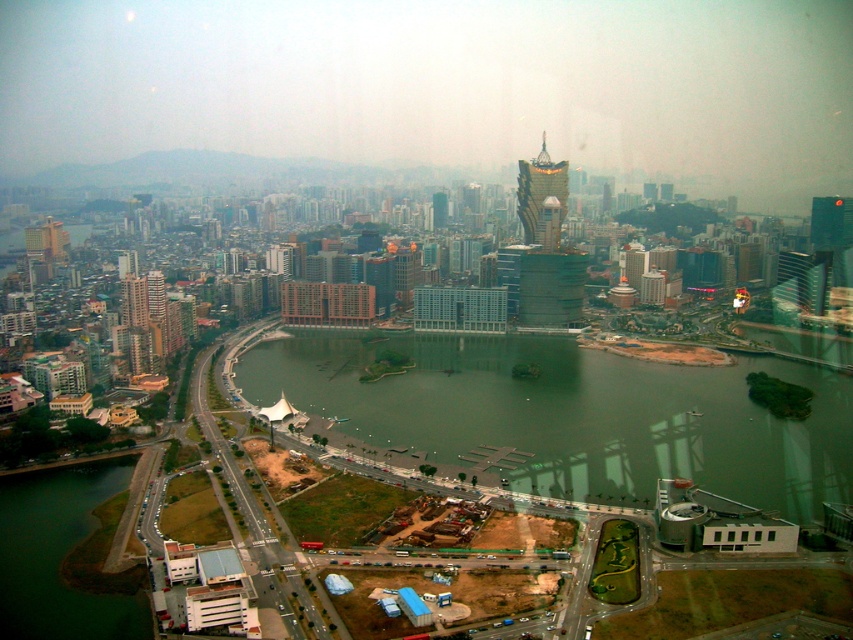
You are standing at the edge of the construction site and want to reach the point marked at coordinates point (68, 628). Given that the construction site is 60 meters wide, can you safely walk across it to reach that point?

The point marked at coordinates point (68, 628) is 68.92 meters away from the viewer. Since the construction site is only 60 meters wide, you would need to walk an extra 8.92 meters beyond the construction site to reach the point, so it might not be safe to walk across the entire distance as the point is outside the construction site area.

You are standing at the edge of the green grassy embankment at lower left and want to walk towards the gold reflective tower at center. Is the tower visible from your current position?

Yes, the gold reflective tower at center is visible because the green grassy embankment at lower left is closer to the viewer, so there is no obstruction blocking the view.